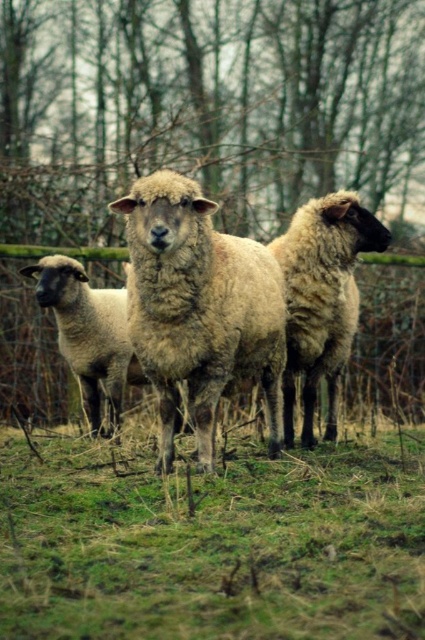
You are a photographer trying to capture a clear shot of the light brown woolly sheep at center without the brown textured tree at center blocking it. Based on their positions, can you move to a position where the tree won

The brown textured tree at center is closer to you than the light brown woolly sheep at center. By moving to a position where the tree is no longer directly in front of the sheep, you can ensure the sheep is visible without obstruction.

You are a painter setting up your easel in the field. You want to paint the brown textured tree at center and the fuzzy woolen sheep at center. If you want to emphasize the tree in your painting, which object should you place closer to the foreground, and why?

You should place the brown textured tree at center closer to the foreground because its width is larger than the fuzzy woolen sheep at center, making it more dominant when positioned nearer to the viewer.

Consider the image. You are standing in the field and want to place a small flag at the point closer to you between point (x=227, y=566) and point (x=155, y=179). Which point should you choose?

You should choose point (x=227, y=566) because it is closer to the viewer than point (x=155, y=179) according to the description.